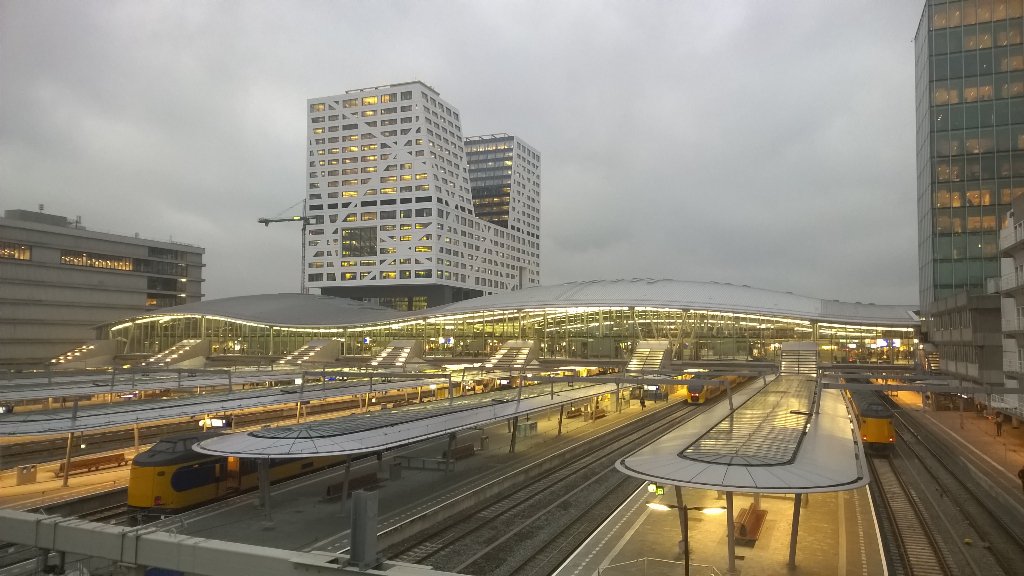
I want to click on glass wall, so click(714, 321), click(582, 320), click(215, 325).